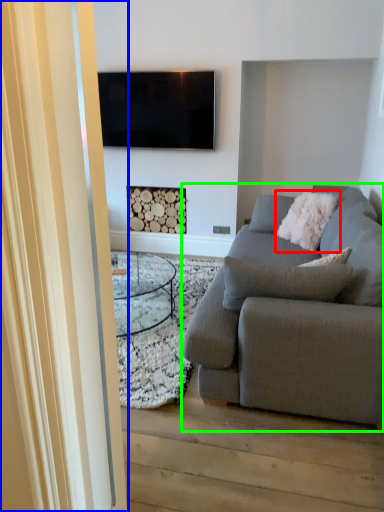
Question: Estimate the real-world distances between objects in this image. Which object is farther from pillow (highlighted by a red box), glass door (highlighted by a blue box) or studio couch (highlighted by a green box)?

Choices:
 (A) glass door
 (B) studio couch

Answer: (A)